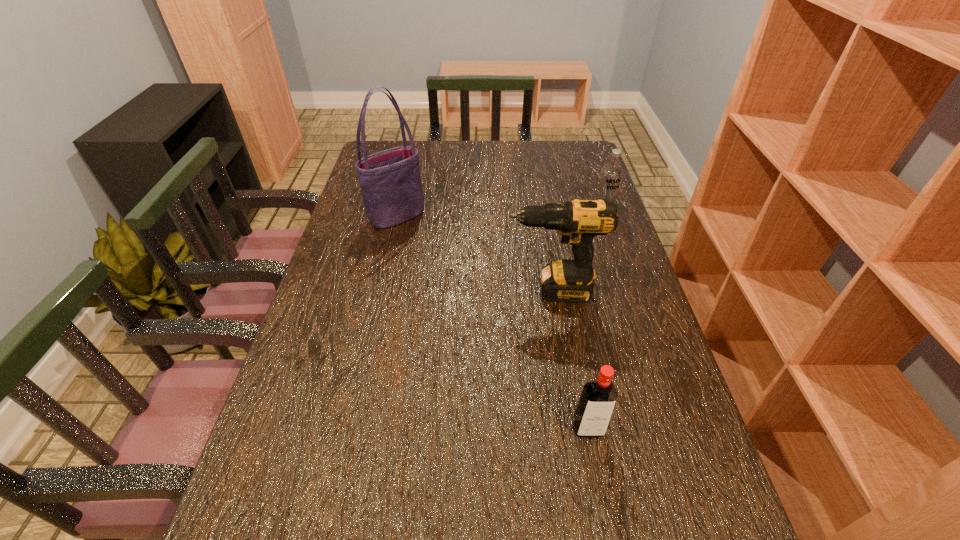
Image resolution: width=960 pixels, height=540 pixels. In order to click on the tallest object in this screenshot , I will do pos(390,180).

Image resolution: width=960 pixels, height=540 pixels. In order to click on the leftmost object in this screenshot , I will do `click(390, 180)`.

The image size is (960, 540). Find the location of `the second nearest object`. the second nearest object is located at coordinates [569, 280].

What are the coordinates of `the third shortest object` in the screenshot? It's located at (569, 280).

Locate an element on the screen. The height and width of the screenshot is (540, 960). the rightmost object is located at coordinates (611, 174).

Where is `the farther vodka`? The height and width of the screenshot is (540, 960). the farther vodka is located at coordinates (611, 174).

The height and width of the screenshot is (540, 960). I want to click on the left vodka, so click(598, 398).

Find the location of a particular element. This screenshot has width=960, height=540. the nearest object is located at coordinates (598, 398).

You are a GUI agent. You are given a task and a screenshot of the screen. Output one action in this format:
    pyautogui.click(x=<x>, y=<y>)
    Task: Click on the free space located on the right of the tote bag
    Image resolution: width=960 pixels, height=540 pixels.
    Given the screenshot: What is the action you would take?
    pyautogui.click(x=503, y=217)

In order to click on vacant space located at the tip of the second nearest object in this screenshot , I will do `click(434, 291)`.